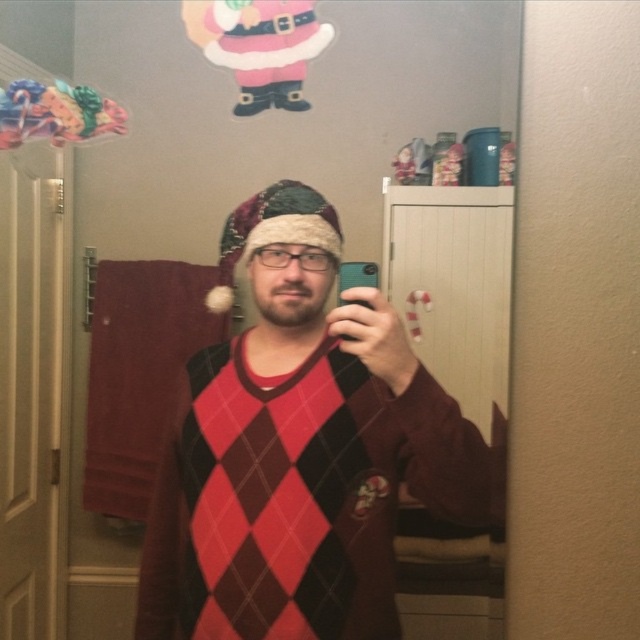
Question: Can you confirm if fuzzy fabric santa hat at center is smaller than black plastic phone at center?

Choices:
 (A) yes
 (B) no

Answer: (B)

Question: Among these points, which one is farthest from the camera?

Choices:
 (A) (339, 272)
 (B) (323, 232)

Answer: (A)

Question: Does fuzzy fabric santa hat at center appear over black plastic phone at center?

Choices:
 (A) no
 (B) yes

Answer: (B)

Question: Is fuzzy fabric santa hat at center smaller than black plastic phone at center?

Choices:
 (A) yes
 (B) no

Answer: (B)